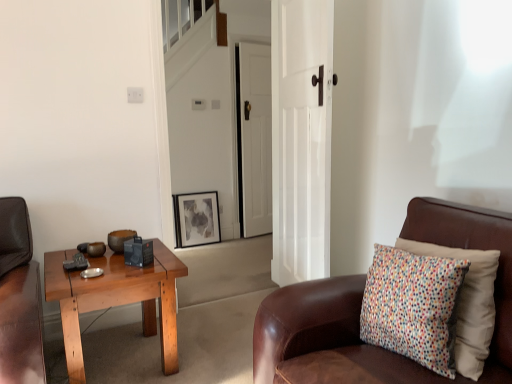
Identify the location of vacant region in front of white wooden door at center, which is the 2th door in front-to-back order. (255, 245).